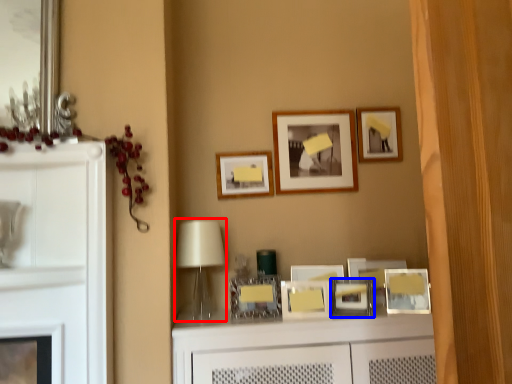
Question: Which object is further to the camera taking this photo, table lamp (highlighted by a red box) or picture frame (highlighted by a blue box)?

Choices:
 (A) table lamp
 (B) picture frame

Answer: (B)